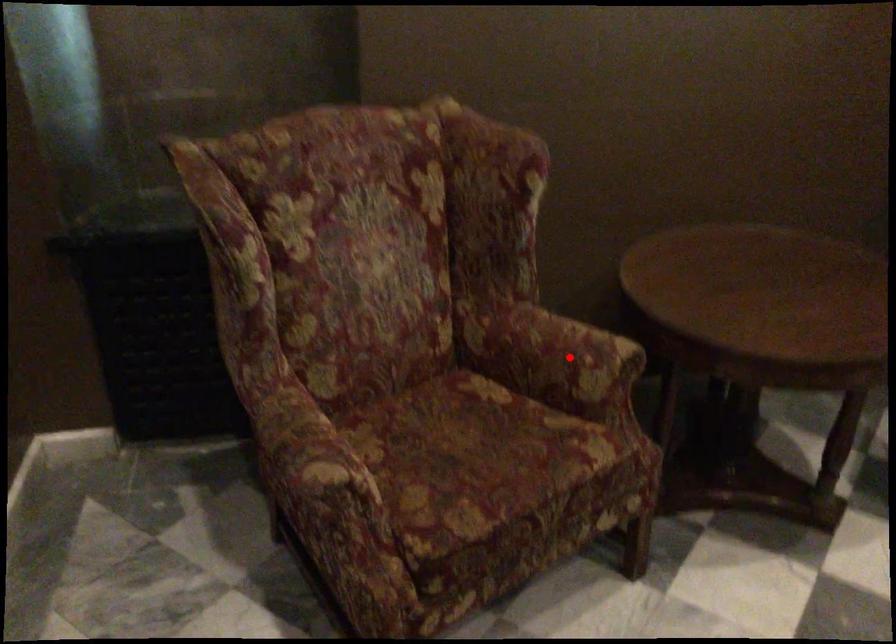
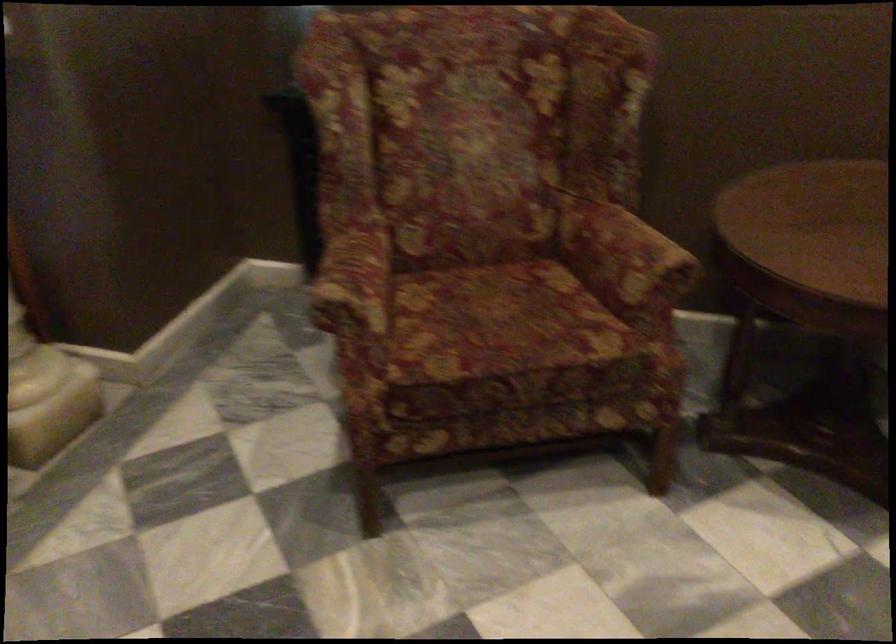
Question: I am providing you with two images of the same scene from different viewpoints. A red point is marked on the first image. Can you still see the location of the red point in image 2?

Choices:
 (A) Yes
 (B) No

Answer: (A)